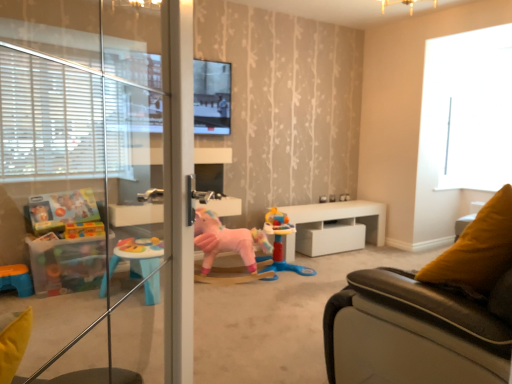
Question: Visually, is transparent glass window at upper right positioned to the left or to the right of white glossy table at center?

Choices:
 (A) left
 (B) right

Answer: (B)

Question: Considering the positions of transparent glass window at upper right and white glossy table at center in the image, is transparent glass window at upper right taller or shorter than white glossy table at center?

Choices:
 (A) short
 (B) tall

Answer: (B)

Question: Which object is the farthest from the white glossy table at center?

Choices:
 (A) matte black tv at upper center
 (B) rubberized plastic playset at center, the first toy in the right-to-left sequence
 (C) transparent glass screen door at left
 (D) pink plush unicorn at center, placed as the 2th toy when sorted from right to left
 (E) transparent glass window at upper right

Answer: (C)

Question: Based on their relative distances, which object is farther from the pink plush unicorn at center, acting as the 1th toy starting from the left?

Choices:
 (A) rubberized plastic playset at center, the first toy in the right-to-left sequence
 (B) transparent glass window at upper right
 (C) matte black tv at upper center
 (D) white glossy table at center
 (E) transparent glass screen door at left

Answer: (B)